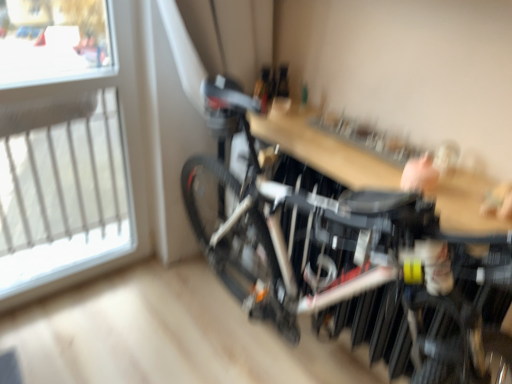
At what (x,y) coordinates should I click in order to perform the action: click on vacant space situated above wooden table at center (from a real-world perspective). Please return your answer as a coordinate pair (x, y). This screenshot has height=384, width=512. Looking at the image, I should click on (352, 139).